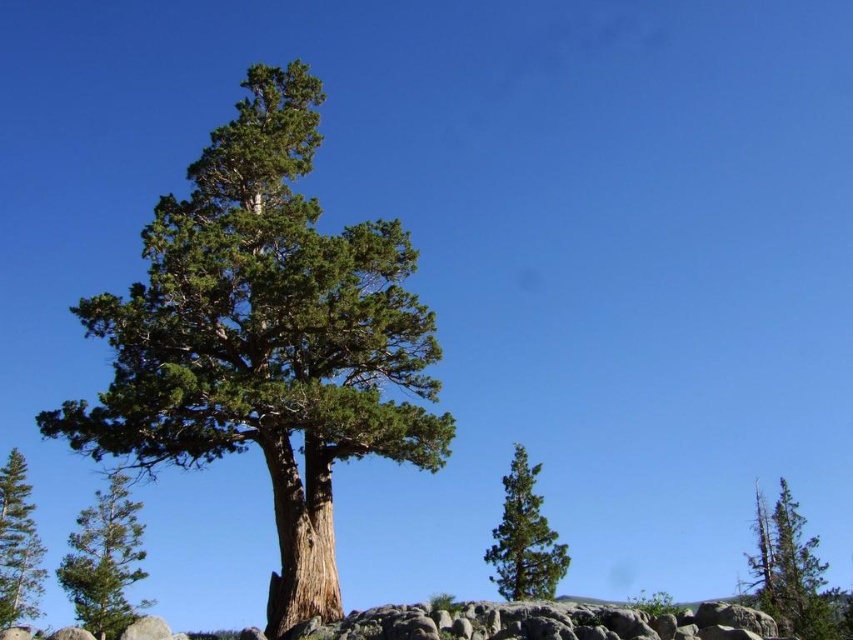
From the picture: You are standing in front of the majestic pine tree and notice two green rough bark trees in the lower part of the scene. Which of the two trees, the green rough bark tree at lower left or the green rough bark tree at lower right, is positioned higher up in the image?

The green rough bark tree at lower left is positioned higher up in the image than the green rough bark tree at lower right.

You are standing at the center of the image and want to walk towards the green matte tree at lower right. In which direction should you move relative to your current position?

Since the green matte tree at lower right is located at coordinates approximately 0.842 on the x axis and 0.615 on the y axis, you should move towards the lower right direction from your current position at the center.